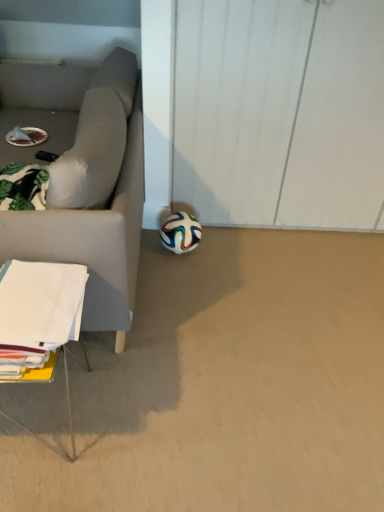
Question: Should I look upward or downward to see white paper at lower left?

Choices:
 (A) up
 (B) down

Answer: (B)

Question: From a real-world perspective, is multicolored rubber football at lower center below white paper at lower left?

Choices:
 (A) yes
 (B) no

Answer: (A)

Question: Is multicolored rubber football at lower center positioned in front of white paper at lower left?

Choices:
 (A) yes
 (B) no

Answer: (B)

Question: Does multicolored rubber football at lower center appear on the right side of white paper at lower left?

Choices:
 (A) no
 (B) yes

Answer: (B)

Question: Does multicolored rubber football at lower center have a lesser width compared to white paper at lower left?

Choices:
 (A) no
 (B) yes

Answer: (B)

Question: Is multicolored rubber football at lower center turned away from white paper at lower left?

Choices:
 (A) no
 (B) yes

Answer: (A)

Question: From the image's perspective, would you say multicolored rubber football at lower center is positioned over white paper at lower left?

Choices:
 (A) yes
 (B) no

Answer: (A)

Question: Are white paper at lower left and multicolored rubber football at lower center far apart?

Choices:
 (A) no
 (B) yes

Answer: (A)

Question: Considering the relative sizes of white paper at lower left and multicolored rubber football at lower center in the image provided, is white paper at lower left wider than multicolored rubber football at lower center?

Choices:
 (A) yes
 (B) no

Answer: (A)

Question: Is white paper at lower left closer to the viewer compared to multicolored rubber football at lower center?

Choices:
 (A) yes
 (B) no

Answer: (A)

Question: Is multicolored rubber football at lower center inside white paper at lower left?

Choices:
 (A) no
 (B) yes

Answer: (A)

Question: From the image's perspective, is white paper at lower left under multicolored rubber football at lower center?

Choices:
 (A) no
 (B) yes

Answer: (B)

Question: Is white paper at lower left completely or partially outside of multicolored rubber football at lower center?

Choices:
 (A) no
 (B) yes

Answer: (B)

Question: Considering the positions of multicolored rubber football at lower center and white paper at lower left in the image, is multicolored rubber football at lower center taller or shorter than white paper at lower left?

Choices:
 (A) short
 (B) tall

Answer: (A)